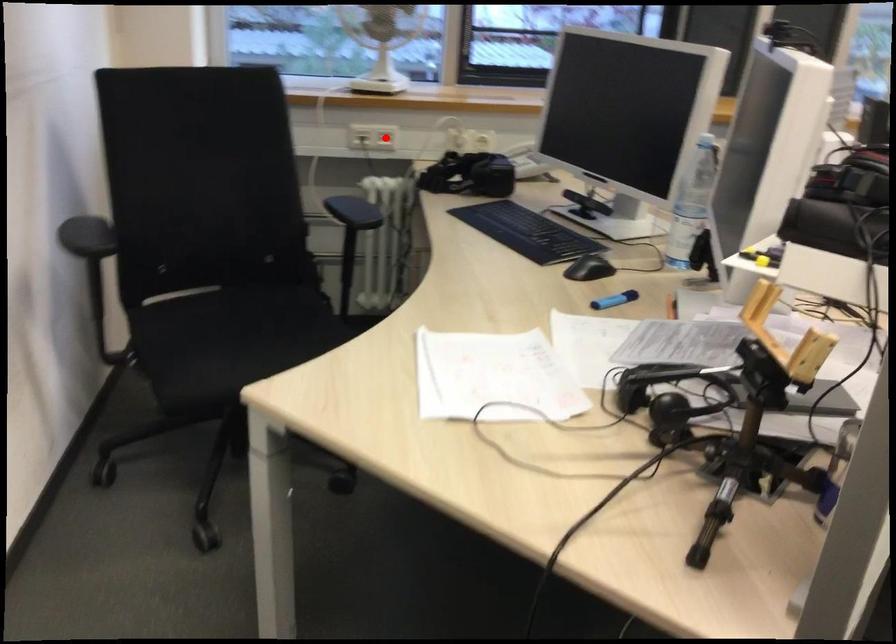
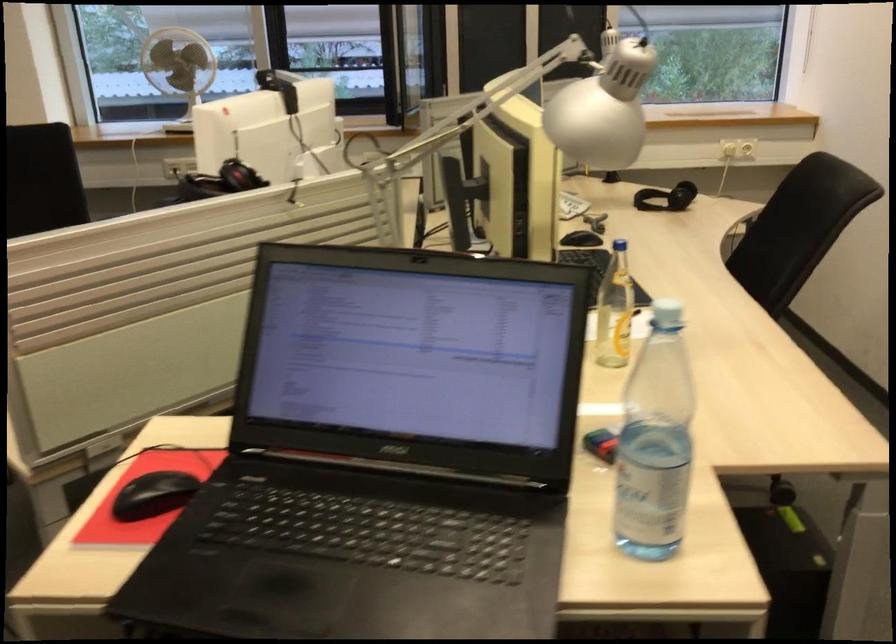
Question: I am providing you with two images of the same scene from different viewpoints. A red point is marked on the first image. Is the red point's position out of view in image 2?

Choices:
 (A) Yes
 (B) No

Answer: (A)